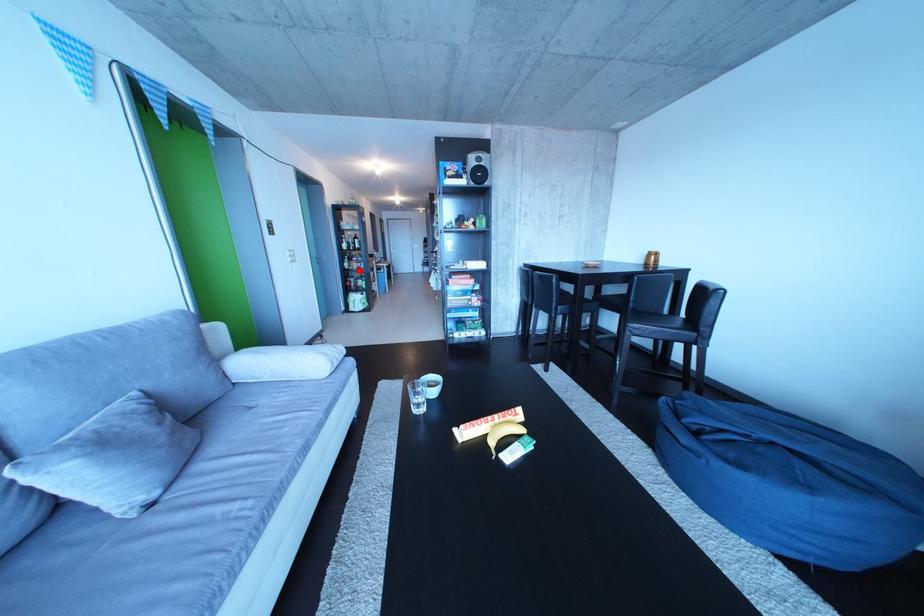
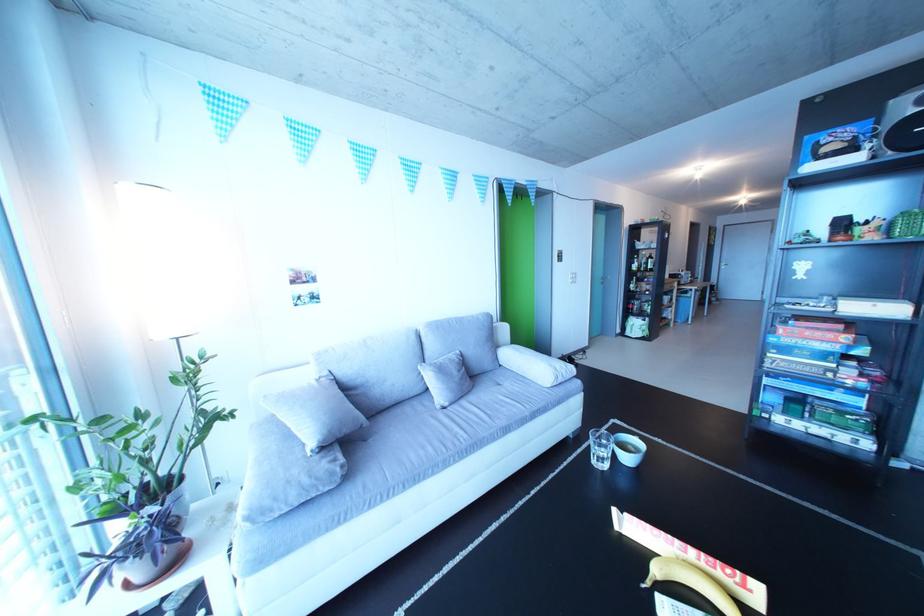
Question: I am providing you with two images of the same scene from different viewpoints. Given a red point in image1, look at the same physical point in image2. Is it:

Choices:
 (A) Closer to the viewpoint
 (B) Farther from the viewpoint

Answer: (B)